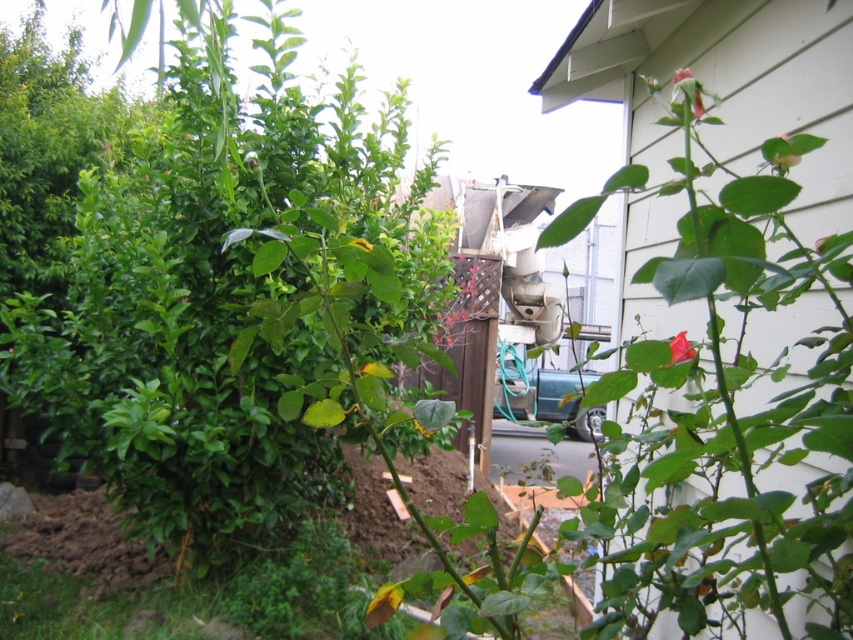
Question: Is green leafy bush at center wider than matte red rose at center right?

Choices:
 (A) yes
 (B) no

Answer: (A)

Question: Considering the real-world distances, which object is closest to the pink matte rosebud at upper right?

Choices:
 (A) matte red rose at center right
 (B) pink matte rose at upper center
 (C) green leafy bush at center

Answer: (A)

Question: Is green leafy bush at center to the left of pink matte rosebud at upper right from the viewer's perspective?

Choices:
 (A) yes
 (B) no

Answer: (A)

Question: Which object appears farthest from the camera in this image?

Choices:
 (A) green leafy bush at center
 (B) green matte rose at upper right
 (C) matte red rose at center right

Answer: (A)

Question: Is pink matte rosebud at upper right behind green matte rose at upper right?

Choices:
 (A) yes
 (B) no

Answer: (B)

Question: Which object is farther from the camera taking this photo?

Choices:
 (A) green leafy bush at center
 (B) matte red rose at center right
 (C) green matte rose at upper right
 (D) green matte leaf at center

Answer: (A)